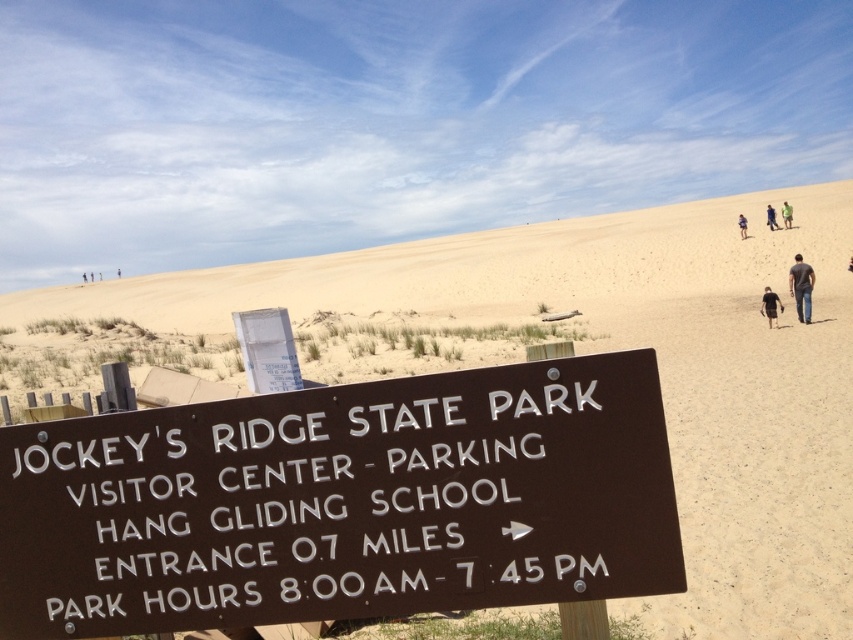
Question: Which point is closer to the camera taking this photo?

Choices:
 (A) (793, 275)
 (B) (761, 307)

Answer: (A)

Question: Can you confirm if black fabric shirt at lower center is thinner than green fabric shirt at upper right?

Choices:
 (A) yes
 (B) no

Answer: (B)

Question: Is dark blue jeans at lower right thinner than green fabric pants at upper right?

Choices:
 (A) no
 (B) yes

Answer: (A)

Question: Estimate the real-world distances between objects in this image. Which object is closer to the green fabric pants at upper right?

Choices:
 (A) brown polished wood sign at center
 (B) blue fabric shirt at upper center
 (C) dark blue jeans at lower right

Answer: (B)

Question: Considering the relative positions of brown polished wood sign at center and green fabric pants at upper right in the image provided, where is brown polished wood sign at center located with respect to green fabric pants at upper right?

Choices:
 (A) below
 (B) above

Answer: (A)

Question: Which object is farther from the camera taking this photo?

Choices:
 (A) brown polished wood sign at center
 (B) green fabric pants at upper right

Answer: (B)